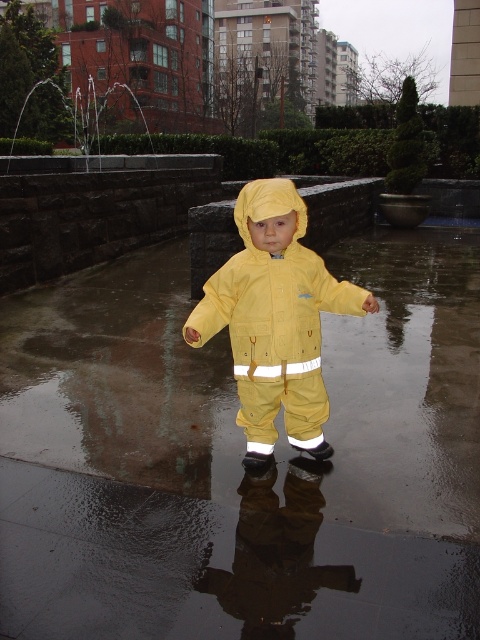
Consider the image. Who is positioned more to the left, glossy concrete pavement at center or yellow matte rain suit at center?

Positioned to the left is glossy concrete pavement at center.

Who is more forward, (307, 593) or (276, 234)?

Point (307, 593)

Who is more distant from viewer, (4,595) or (263,330)?

The point (263,330) is behind.

Find the location of a particular element. glossy concrete pavement at center is located at coordinates (216, 564).